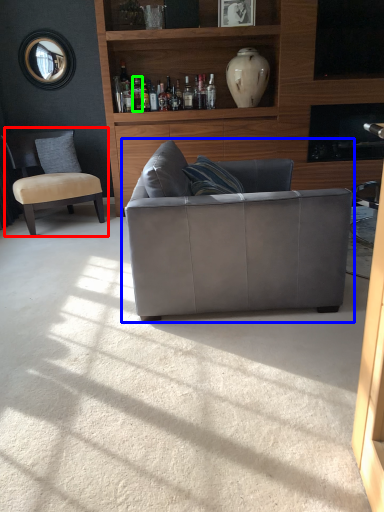
Question: Estimate the real-world distances between objects in this image. Which object is closer to chair (highlighted by a red box), studio couch (highlighted by a blue box) or bottle (highlighted by a green box)?

Choices:
 (A) studio couch
 (B) bottle

Answer: (B)